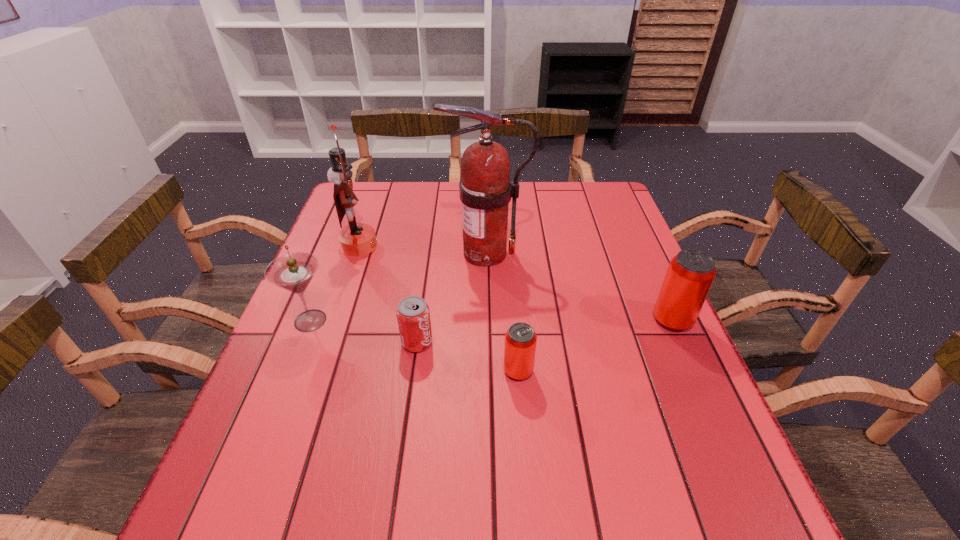
The width and height of the screenshot is (960, 540). Identify the location of unoccupied area between the shorter can and the fourth object from right to left. (468, 356).

The width and height of the screenshot is (960, 540). I want to click on empty location between the fire extinguisher and the nutcracker, so click(x=422, y=249).

At what (x,y) coordinates should I click in order to perform the action: click on free space that is in between the soda can and the shorter can. Please return your answer as a coordinate pair (x, y). Looking at the image, I should click on (468, 356).

You are a GUI agent. You are given a task and a screenshot of the screen. Output one action in this format:
    pyautogui.click(x=<x>, y=<y>)
    Task: Click on the vacant region between the nutcracker and the right can
    This screenshot has width=960, height=540.
    Given the screenshot: What is the action you would take?
    pyautogui.click(x=516, y=283)

Select which object is the second closest to the soda can. Please provide its 2D coordinates. Your answer should be formatted as a tuple, i.e. [(x, y)], where the tuple contains the x and y coordinates of a point satisfying the conditions above.

[(294, 271)]

What are the coordinates of `the second closest object to the left can` in the screenshot? It's located at (690, 274).

Locate an element on the screen. The width and height of the screenshot is (960, 540). vacant region that satisfies the following two spatial constraints: 1. on the front side of the martini; 2. on the right side of the nearest object is located at coordinates (291, 370).

At what (x,y) coordinates should I click in order to perform the action: click on vacant point that satisfies the following two spatial constraints: 1. on the front-facing side of the nutcracker; 2. on the left side of the shorter can. Please return your answer as a coordinate pair (x, y). The height and width of the screenshot is (540, 960). Looking at the image, I should click on (317, 370).

The height and width of the screenshot is (540, 960). I want to click on blank area in the image that satisfies the following two spatial constraints: 1. on the front-facing side of the right can; 2. on the right side of the nutcracker, so click(334, 320).

Find the location of a particular element. free location that satisfies the following two spatial constraints: 1. on the front-facing side of the nutcracker; 2. on the left side of the soda can is located at coordinates (326, 342).